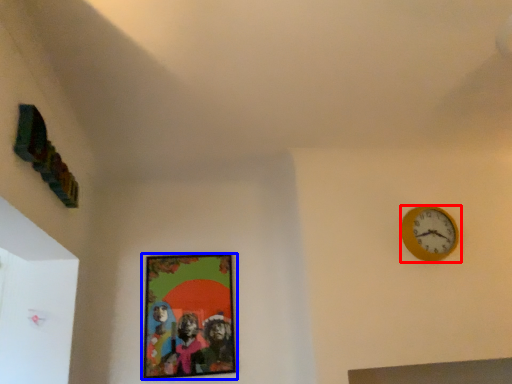
Question: Which of the following is the closest to the observer, wall clock (highlighted by a red box) or picture frame (highlighted by a blue box)?

Choices:
 (A) wall clock
 (B) picture frame

Answer: (A)